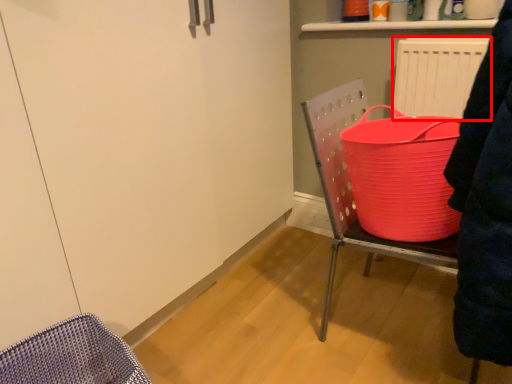
Question: In this image, where is radiator (annotated by the red box) located relative to furniture?

Choices:
 (A) left
 (B) right

Answer: (B)